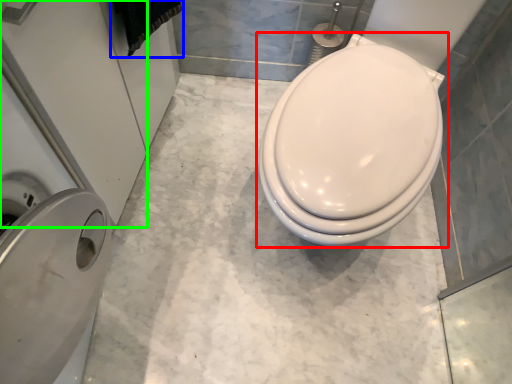
Question: Based on their relative distances, which object is nearer to toilet (highlighted by a red box)? Choose from material (highlighted by a blue box) and screen door (highlighted by a green box).

Choices:
 (A) material
 (B) screen door

Answer: (A)